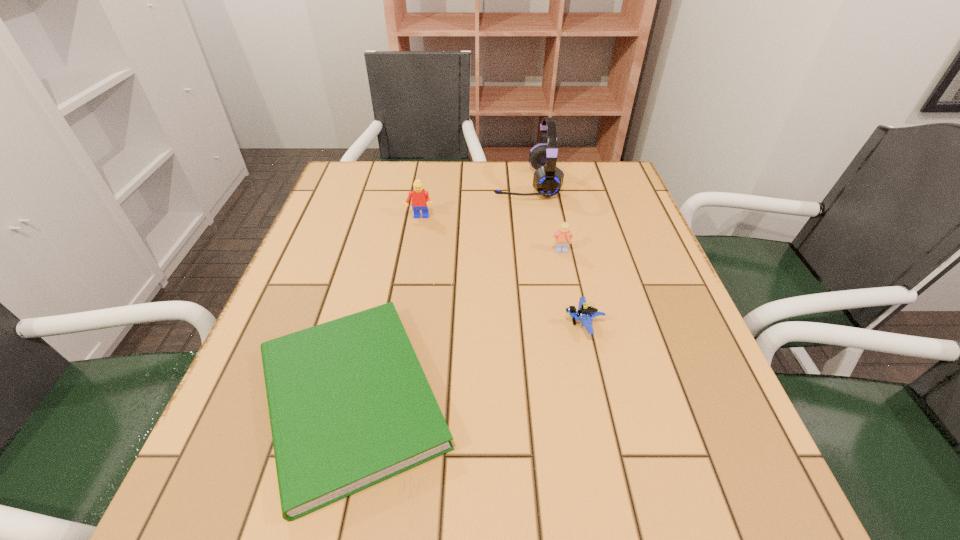
In order to click on object that is at the left edge in this screenshot , I will do `click(349, 404)`.

Find the location of a particular element. object that is at the near left corner is located at coordinates (349, 404).

Where is `free space at the far edge`? This screenshot has height=540, width=960. free space at the far edge is located at coordinates (557, 195).

Locate an element on the screen. blank space at the near edge of the desktop is located at coordinates pyautogui.click(x=591, y=482).

In the image, there is a desktop. Where is `free space at the left edge`? The width and height of the screenshot is (960, 540). free space at the left edge is located at coordinates (330, 294).

You are a GUI agent. You are given a task and a screenshot of the screen. Output one action in this format:
    pyautogui.click(x=<x>, y=<y>)
    Task: Click on the free space at the right edge of the desktop
    The width and height of the screenshot is (960, 540).
    Given the screenshot: What is the action you would take?
    pyautogui.click(x=674, y=405)

Locate an element on the screen. This screenshot has height=540, width=960. vacant space at the far left corner of the desktop is located at coordinates pos(351,200).

In the image, there is a desktop. Identify the location of free space at the far right corner. (596, 179).

The height and width of the screenshot is (540, 960). I want to click on vacant space at the near right corner of the desktop, so click(770, 497).

You are a GUI agent. You are given a task and a screenshot of the screen. Output one action in this format:
    pyautogui.click(x=<x>, y=<y>)
    Task: Click on the free space between the shortest Lego and the shortest object
    
    Given the screenshot: What is the action you would take?
    pyautogui.click(x=468, y=361)